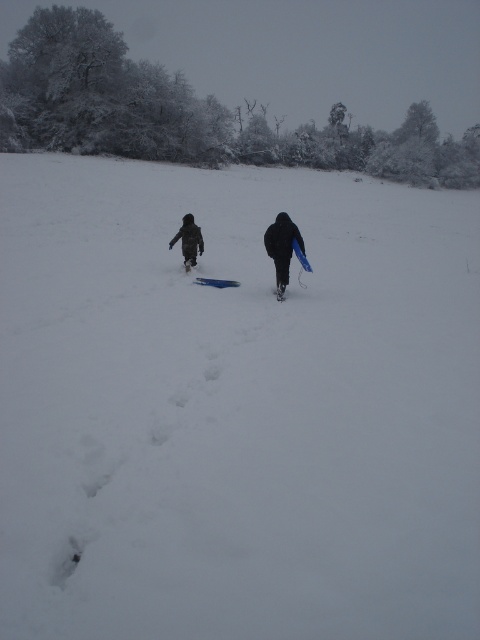
Question: Among these objects, which one is farthest from the camera?

Choices:
 (A) blue plastic ski at center
 (B) dark blue plastic sled at center
 (C) black matte snowshoe at center

Answer: (A)

Question: Considering the real-world distances, which object is farthest from the black matte snowshoe at center?

Choices:
 (A) black matte jacket at center
 (B) blue plastic ski at center

Answer: (B)

Question: Is black matte jacket at center below dark gray fabric jacket at center?

Choices:
 (A) yes
 (B) no

Answer: (A)

Question: Observing the image, what is the correct spatial positioning of dark blue plastic sled at center in reference to black matte jacket at center?

Choices:
 (A) right
 (B) left

Answer: (A)

Question: Does dark gray fabric jacket at center appear over blue plastic ski at center?

Choices:
 (A) yes
 (B) no

Answer: (A)

Question: Which point is farther to the camera?

Choices:
 (A) (207, 282)
 (B) (290, 257)
 (C) (287, 241)
 (D) (282, 284)

Answer: (A)